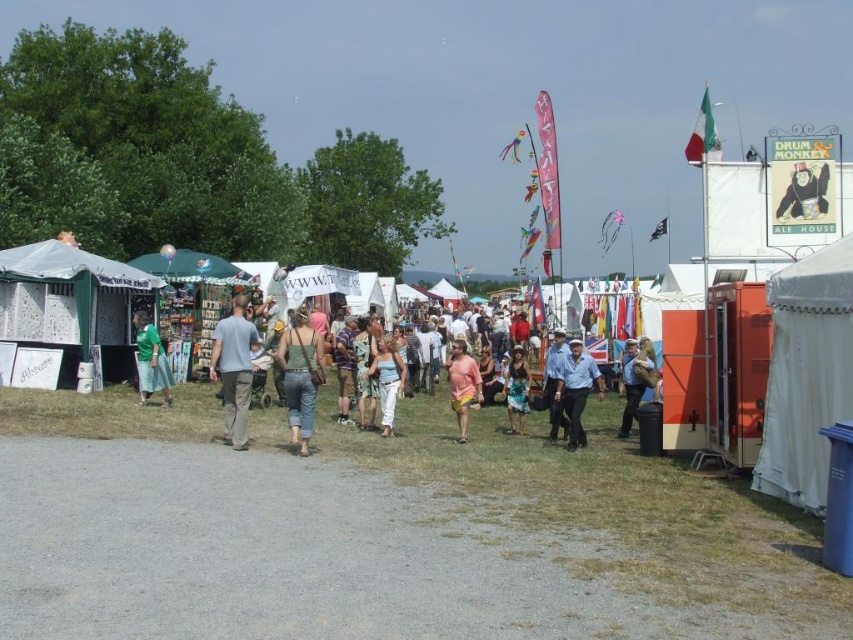
Based on the photo, who is shorter, green fabric tank top at center or blue-green woven skirt at center?

With less height is blue-green woven skirt at center.

Who is higher up, green fabric tank top at center or blue-green woven skirt at center?

Positioned higher is green fabric tank top at center.

Who is more forward, (316,385) or (514,387)?

Point (316,385) is in front.

Locate an element on the screen. Image resolution: width=853 pixels, height=640 pixels. green fabric tank top at center is located at coordinates (300, 378).

Is light blue shirt at center below brown leather jacket at center?

Yes, light blue shirt at center is below brown leather jacket at center.

Is point (567, 419) less distant than point (630, 355)?

Yes.

Image resolution: width=853 pixels, height=640 pixels. In order to click on light blue shirt at center in this screenshot , I will do `click(576, 388)`.

Can you confirm if green fabric tank top at center is wider than light blue denim jeans at center?

In fact, green fabric tank top at center might be narrower than light blue denim jeans at center.

Does point (310, 372) come closer to viewer compared to point (393, 390)?

Yes, point (310, 372) is closer to viewer.

This screenshot has height=640, width=853. Find the location of `green fabric tank top at center`. green fabric tank top at center is located at coordinates (300, 378).